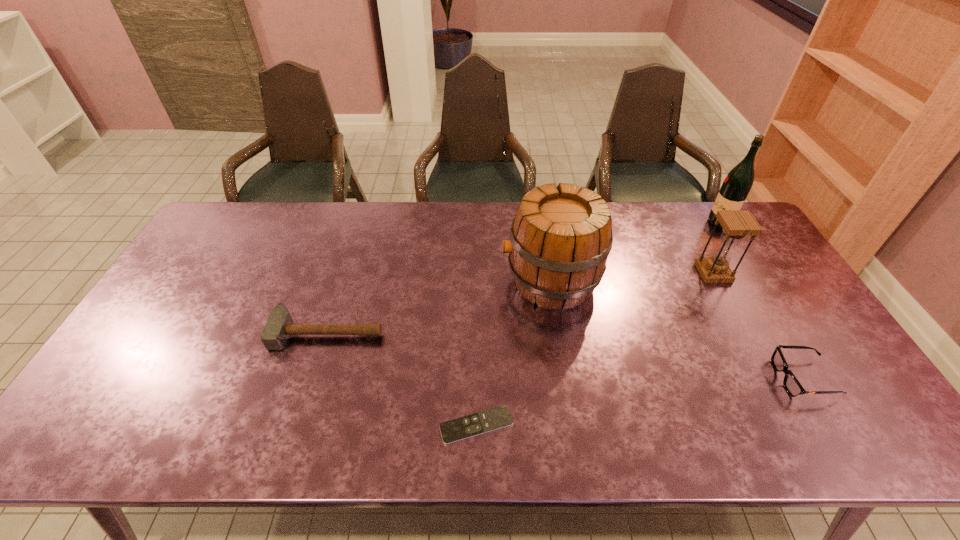
Choose which object is the nearest neighbor to the remote control. Please provide its 2D coordinates. Your answer should be formatted as a tuple, i.e. [(x, y)], where the tuple contains the x and y coordinates of a point satisfying the conditions above.

[(280, 325)]

Locate which object ranks fifth in proximity to the hammer. Please provide its 2D coordinates. Your answer should be formatted as a tuple, i.e. [(x, y)], where the tuple contains the x and y coordinates of a point satisfying the conditions above.

[(739, 181)]

Locate an element on the screen. free space that satisfies the following two spatial constraints: 1. on the striking surface of the leftmost object; 2. on the left side of the nearest object is located at coordinates (300, 425).

Locate an element on the screen. This screenshot has width=960, height=540. blank space that satisfies the following two spatial constraints: 1. on the side of the second tallest object where the spigot is located; 2. on the striking surface of the hammer is located at coordinates (559, 332).

Locate an element on the screen. The height and width of the screenshot is (540, 960). free spot that satisfies the following two spatial constraints: 1. on the front-facing side of the tallest object; 2. on the striking surface of the hammer is located at coordinates (789, 332).

The height and width of the screenshot is (540, 960). Identify the location of vacant area that satisfies the following two spatial constraints: 1. on the striking surface of the leftmost object; 2. on the left side of the remote control. [x=300, y=425].

Image resolution: width=960 pixels, height=540 pixels. I want to click on free location that satisfies the following two spatial constraints: 1. on the side of the cider where the spigot is located; 2. on the front side of the remote control, so click(573, 425).

The height and width of the screenshot is (540, 960). Identify the location of free space that satisfies the following two spatial constraints: 1. on the striking surface of the nearest object; 2. on the left side of the leftmost object. (300, 425).

Where is `free space that satisfies the following two spatial constraints: 1. on the front-facing side of the liquor; 2. on the striking surface of the leftmost object`? This screenshot has width=960, height=540. free space that satisfies the following two spatial constraints: 1. on the front-facing side of the liquor; 2. on the striking surface of the leftmost object is located at coordinates (789, 332).